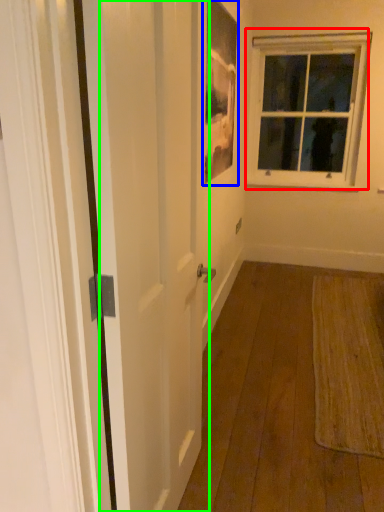
Question: Considering the real-world distances, which object is closest to window (highlighted by a red box)? picture frame (highlighted by a blue box) or screen door (highlighted by a green box).

Choices:
 (A) picture frame
 (B) screen door

Answer: (A)